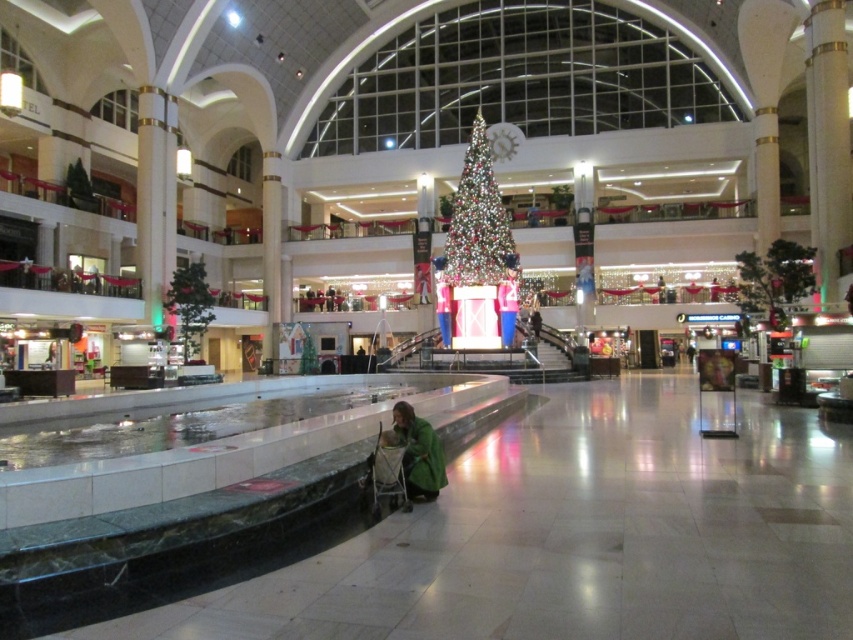
Question: Does iridescent glass christmas tree at center appear under green fabric at center?

Choices:
 (A) yes
 (B) no

Answer: (B)

Question: Which point is closer to the camera?

Choices:
 (A) green fabric at center
 (B) iridescent glass christmas tree at center

Answer: (A)

Question: Is iridescent glass christmas tree at center bigger than green fabric at center?

Choices:
 (A) yes
 (B) no

Answer: (A)

Question: Which of the following is the closest to the observer?

Choices:
 (A) (440, 468)
 (B) (479, 198)

Answer: (A)

Question: Is iridescent glass christmas tree at center bigger than green fabric at center?

Choices:
 (A) no
 (B) yes

Answer: (B)